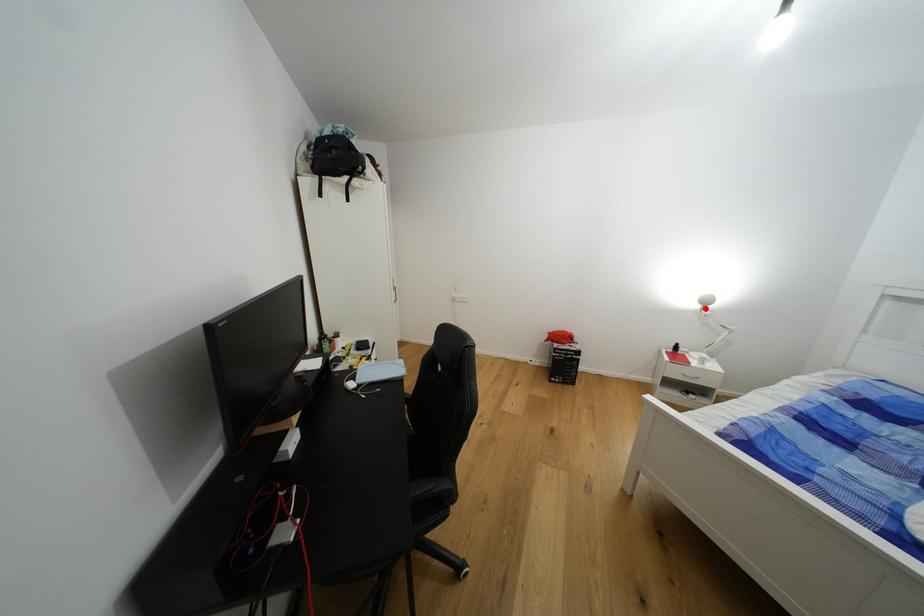
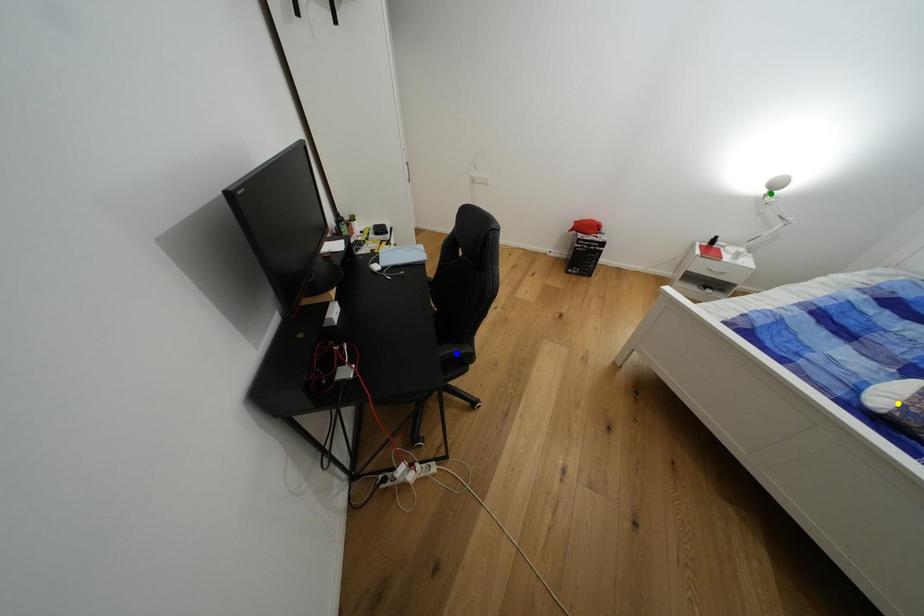
Question: I am providing you with two images of the same scene from different viewpoints. A red point is marked on the first image. You are given multiple points on the second image. In image 2, which mark is for the same physical point as the one in image 1?

Choices:
 (A) green point
 (B) yellow point
 (C) blue point

Answer: (A)